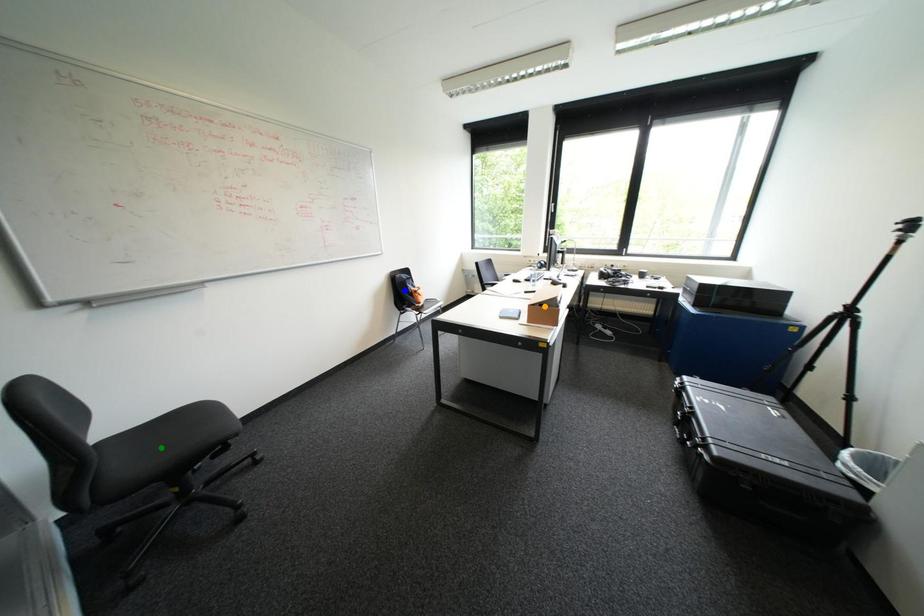
Order these from farthest to nearest:
1. blue point
2. orange point
3. green point

blue point, orange point, green point